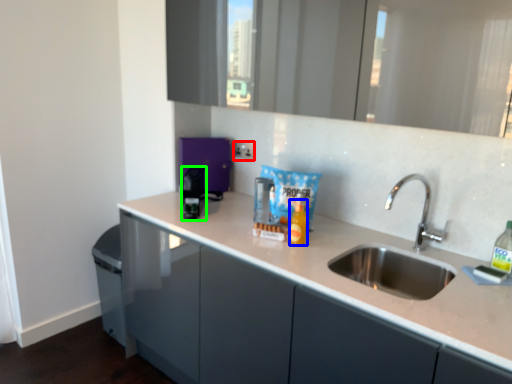
Question: Considering the real-world distances, which object is closest to electric outlet (highlighted by a red box)? bottle (highlighted by a blue box) or appliance (highlighted by a green box).

Choices:
 (A) bottle
 (B) appliance

Answer: (B)